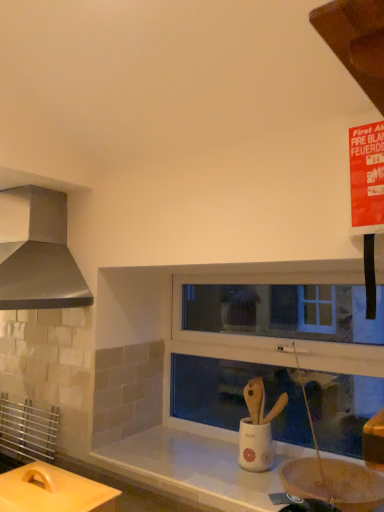
Question: From the image's perspective, is metallic stainless steel range hood at left above or below white plastic window frame at center?

Choices:
 (A) above
 (B) below

Answer: (A)

Question: Would you say metallic stainless steel range hood at left is to the left or to the right of white plastic window frame at center in the picture?

Choices:
 (A) left
 (B) right

Answer: (A)

Question: Which object is the farthest from the matte yellow cutting board at lower left?

Choices:
 (A) white ceramic sink at center
 (B) metallic stainless steel range hood at left
 (C) white plastic window frame at center

Answer: (C)

Question: Estimate the real-world distances between objects in this image. Which object is closer to the metallic stainless steel range hood at left?

Choices:
 (A) white ceramic sink at center
 (B) white plastic window frame at center
 (C) matte yellow cutting board at lower left

Answer: (C)